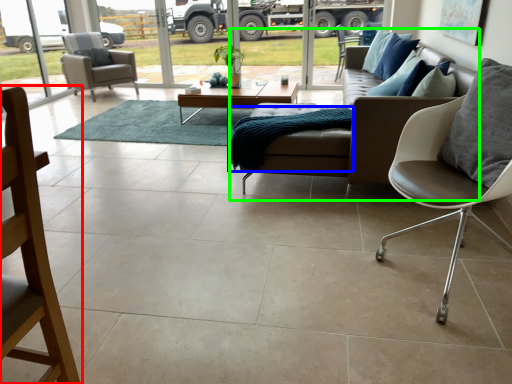
Question: Which is farther away from chair (highlighted by a red box)? blanket (highlighted by a blue box) or studio couch (highlighted by a green box)?

Choices:
 (A) blanket
 (B) studio couch

Answer: (B)